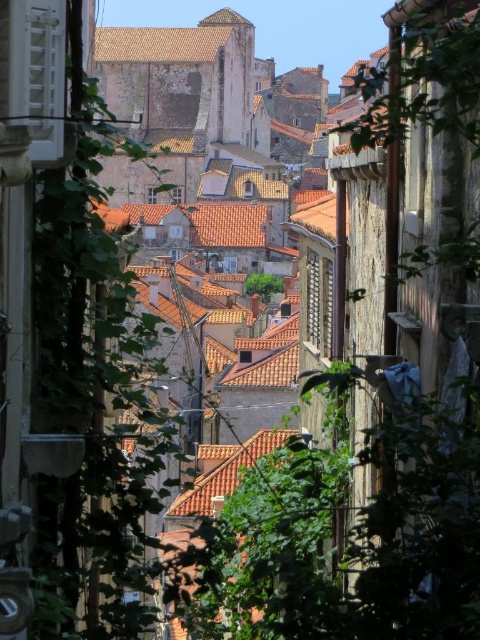
Can you confirm if brown tiled roofs at center is positioned below brown textured roof at upper center?

Yes.

Does brown tiled roofs at center have a greater width compared to brown textured roof at upper center?

Yes.

Is point (264, 410) in front of point (202, 56)?

That is True.

Identify the location of brown tiled roofs at center. (200, 161).

Is point (134, 51) positioned after point (248, 461)?

Yes.

Which is more to the right, brown textured roof at upper center or terracotta tiled roof at center?

terracotta tiled roof at center

Who is more forward, [210,60] or [252,465]?

Point [252,465]

Find the location of a particular element. The image size is (480, 640). brown textured roof at upper center is located at coordinates (170, 38).

Is brown tiled roofs at center in front of terracotta tiled roof at center?

No, brown tiled roofs at center is further to the viewer.

Between point (202, 202) and point (220, 451), which one is positioned behind?

The point (202, 202) is more distant.

The width and height of the screenshot is (480, 640). What are the coordinates of `brown tiled roofs at center` in the screenshot? It's located at (200, 161).